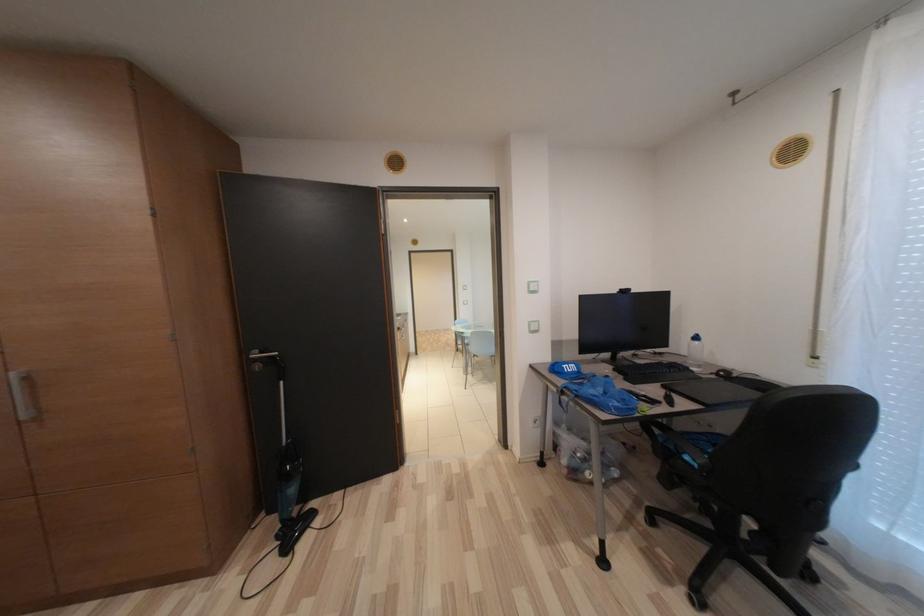
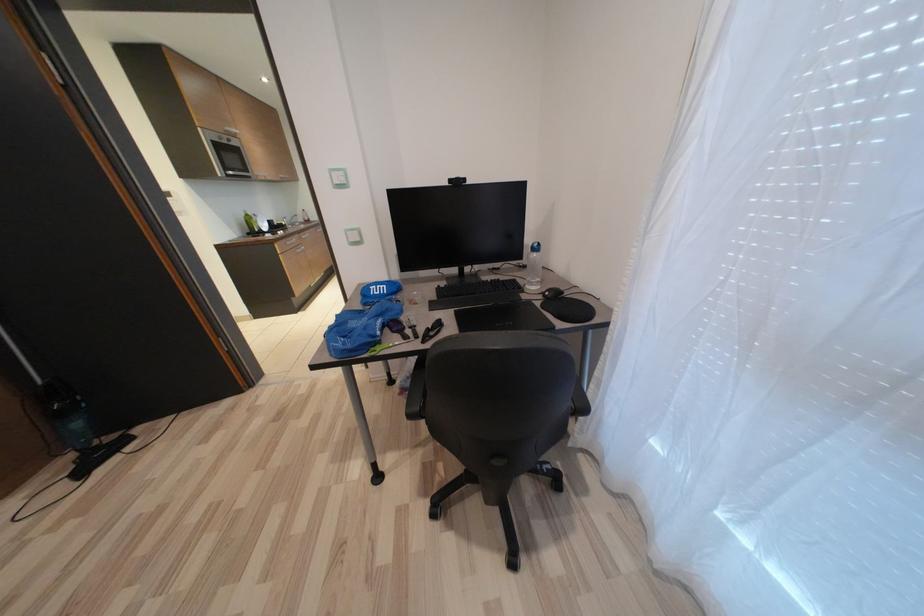
Question: In a continuous first-person perspective shot, in which direction is the camera moving?

Choices:
 (A) Left
 (B) Right
 (C) Forward
 (D) Backward

Answer: (B)